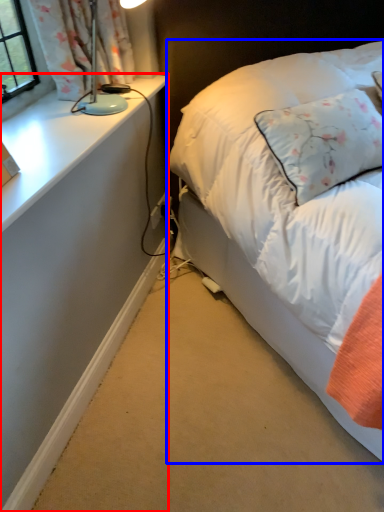
Question: Which object is further to the camera taking this photo, desk (highlighted by a red box) or bed (highlighted by a blue box)?

Choices:
 (A) desk
 (B) bed

Answer: (A)